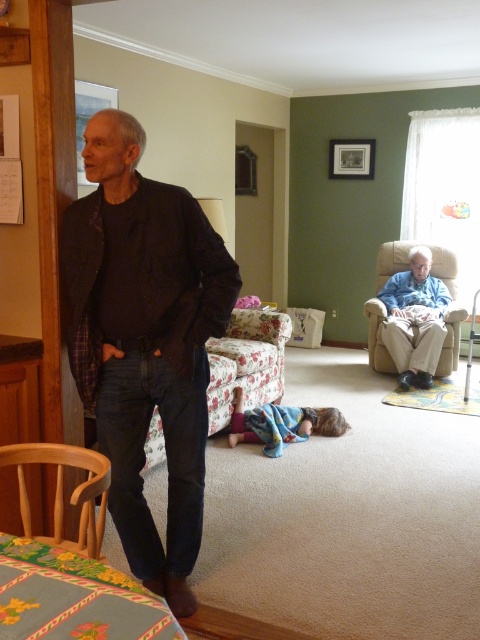
You are planning to rearrange the furniture in the living room and need to know which armchair takes up more floor space. Which one is larger in size between the wooden armchair at lower left and the beige fabric armchair at center right?

The beige fabric armchair at center right is larger in size because the wooden armchair at lower left occupies less space than it.

You are a delivery person standing at the entrance of the living room. You need to place a large package between the wooden armchair at lower left and the beige fabric armchair at center right. The package requires 10 feet of space. Is there enough space between them?

The wooden armchair at lower left is 12.68 feet away from the beige fabric armchair at center right. Since the required space is 10 feet, there is enough space to place the package between them.